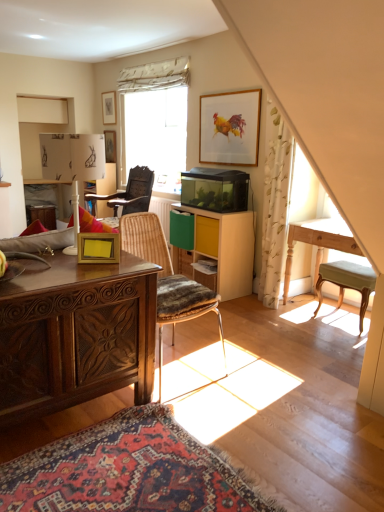
Question: Considering the relative sizes of polished wood desk at left and green fabric stool at right, the 2th chair from the back, in the image provided, is polished wood desk at left taller than green fabric stool at right, the 2th chair from the back,?

Choices:
 (A) yes
 (B) no

Answer: (A)

Question: Is polished wood desk at left facing towards green fabric stool at right, the 1th chair when ordered from right to left?

Choices:
 (A) yes
 (B) no

Answer: (B)

Question: Is the surface of polished wood desk at left in direct contact with green fabric stool at right, the 2th chair from the back?

Choices:
 (A) no
 (B) yes

Answer: (A)

Question: Is polished wood desk at left oriented away from green fabric stool at right, the 2th chair from the back?

Choices:
 (A) no
 (B) yes

Answer: (A)

Question: Is polished wood desk at left bigger than green fabric stool at right, the 1th chair when ordered from right to left?

Choices:
 (A) no
 (B) yes

Answer: (B)

Question: Considering the relative positions of polished wood desk at left and green fabric stool at right, the 1th chair when ordered from right to left, in the image provided, is polished wood desk at left in front of green fabric stool at right, the 1th chair when ordered from right to left,?

Choices:
 (A) no
 (B) yes

Answer: (B)

Question: Is rustic wood chair at center, arranged as the 3th chair when viewed from the back, to the left of yellow matte drawer at center from the viewer's perspective?

Choices:
 (A) yes
 (B) no

Answer: (A)

Question: Is rustic wood chair at center, the second chair positioned from the right, oriented towards yellow matte drawer at center?

Choices:
 (A) no
 (B) yes

Answer: (A)

Question: Would you say yellow matte drawer at center is part of rustic wood chair at center, arranged as the 3th chair when viewed from the back,'s contents?

Choices:
 (A) yes
 (B) no

Answer: (B)

Question: Would you say rustic wood chair at center, marked as the 1th chair in a front-to-back arrangement, is outside yellow matte drawer at center?

Choices:
 (A) yes
 (B) no

Answer: (A)

Question: From a real-world perspective, is rustic wood chair at center, the 2th chair viewed from the left, beneath yellow matte drawer at center?

Choices:
 (A) yes
 (B) no

Answer: (A)

Question: Does rustic wood chair at center, marked as the 1th chair in a front-to-back arrangement, have a greater height compared to yellow matte drawer at center?

Choices:
 (A) no
 (B) yes

Answer: (B)

Question: Does polished wood desk at left have a smaller size compared to rustic wood chair at center, the second chair positioned from the right?

Choices:
 (A) no
 (B) yes

Answer: (A)